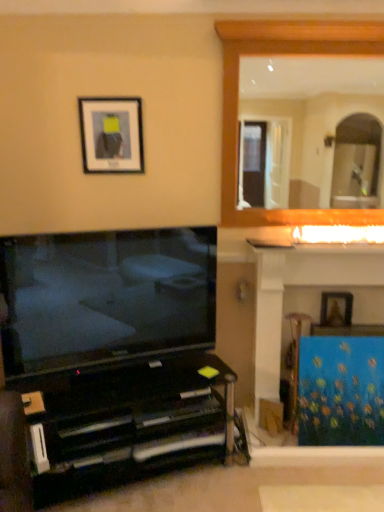
Question: From the image's perspective, is matte black tv at lower left above blue canvas painting at right?

Choices:
 (A) yes
 (B) no

Answer: (A)

Question: From a real-world perspective, is matte black tv at lower left on blue canvas painting at right?

Choices:
 (A) no
 (B) yes

Answer: (B)

Question: Does matte black tv at lower left appear on the right side of blue canvas painting at right?

Choices:
 (A) no
 (B) yes

Answer: (A)

Question: Is matte black tv at lower left taller than blue canvas painting at right?

Choices:
 (A) no
 (B) yes

Answer: (A)

Question: Would you say matte black tv at lower left is outside blue canvas painting at right?

Choices:
 (A) yes
 (B) no

Answer: (A)

Question: Is matte black tv at lower left at the left side of blue canvas painting at right?

Choices:
 (A) no
 (B) yes

Answer: (B)

Question: Considering the relative sizes of wooden frame at upper right and black glossy entertainment center at lower left in the image provided, is wooden frame at upper right shorter than black glossy entertainment center at lower left?

Choices:
 (A) yes
 (B) no

Answer: (B)

Question: Is wooden frame at upper right to the left of black glossy entertainment center at lower left from the viewer's perspective?

Choices:
 (A) no
 (B) yes

Answer: (A)

Question: From a real-world perspective, is wooden frame at upper right positioned under black glossy entertainment center at lower left based on gravity?

Choices:
 (A) yes
 (B) no

Answer: (B)

Question: From the image's perspective, is wooden frame at upper right below black glossy entertainment center at lower left?

Choices:
 (A) yes
 (B) no

Answer: (B)

Question: Is wooden frame at upper right positioned with its back to black glossy entertainment center at lower left?

Choices:
 (A) yes
 (B) no

Answer: (B)

Question: Does wooden frame at upper right have a greater height compared to black glossy entertainment center at lower left?

Choices:
 (A) yes
 (B) no

Answer: (A)

Question: Is wooden picture frame at upper right, the second picture frame positioned from the front, not near blue fabric at right?

Choices:
 (A) yes
 (B) no

Answer: (B)